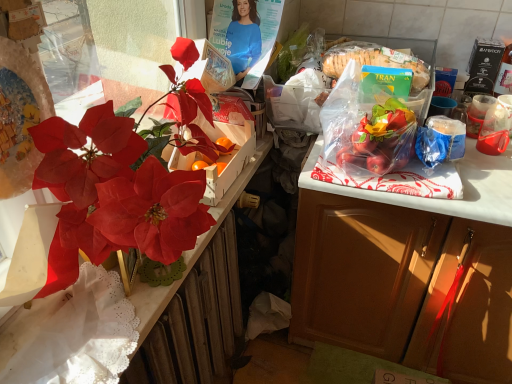
Identify the location of free point above white lace wrapping paper at left (from a real-world perspective). (81, 329).